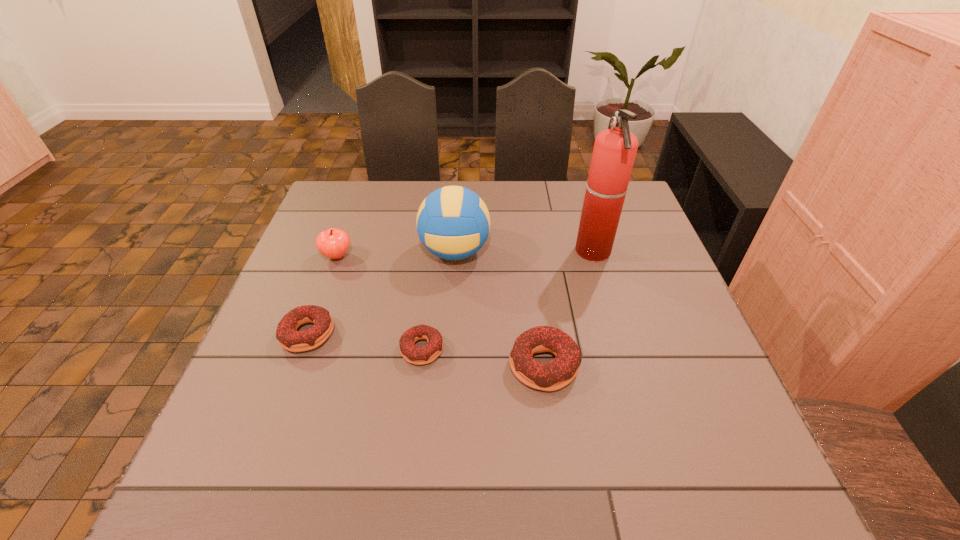
In order to click on free spot that satisfies the following two spatial constraints: 1. on the front side of the tallest doughnut; 2. on the right side of the apple in this screenshot , I will do `click(298, 365)`.

What are the coordinates of `vacant space that satisfies the following two spatial constraints: 1. on the back side of the third tallest object; 2. on the left side of the second shortest doughnut` in the screenshot? It's located at (336, 256).